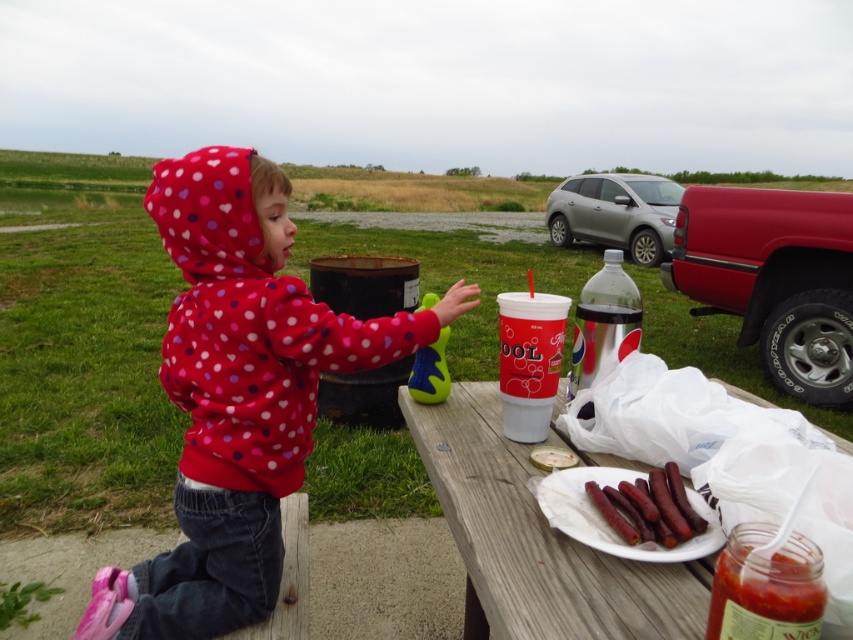
Question: Which point is farther from the camera taking this photo?

Choices:
 (A) (184, 621)
 (B) (575, 384)

Answer: (B)

Question: Which object appears farthest from the camera in this image?

Choices:
 (A) clear plastic bottle at center
 (B) wooden picnic table at lower center
 (C) polka dot fleece hoodie at center

Answer: (A)

Question: Based on their relative distances, which object is nearer to the polka dot fleece hoodie at center?

Choices:
 (A) brown textured hot dogs at lower right
 (B) wooden picnic table at lower center

Answer: (B)

Question: Does polka dot fleece hoodie at center have a greater width compared to clear plastic bottle at center?

Choices:
 (A) yes
 (B) no

Answer: (A)

Question: Observing the image, what is the correct spatial positioning of polka dot fleece hoodie at center in reference to clear plastic bottle at center?

Choices:
 (A) above
 (B) below

Answer: (B)

Question: Can you confirm if polka dot fleece hoodie at center is positioned to the right of wooden picnic table at lower center?

Choices:
 (A) yes
 (B) no

Answer: (B)